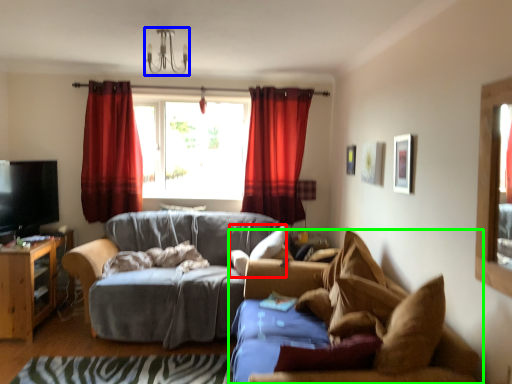
Question: Which object is positioned closest to pillow (highlighted by a red box)? Select from light fixture (highlighted by a blue box) and studio couch (highlighted by a green box).

Choices:
 (A) light fixture
 (B) studio couch

Answer: (B)